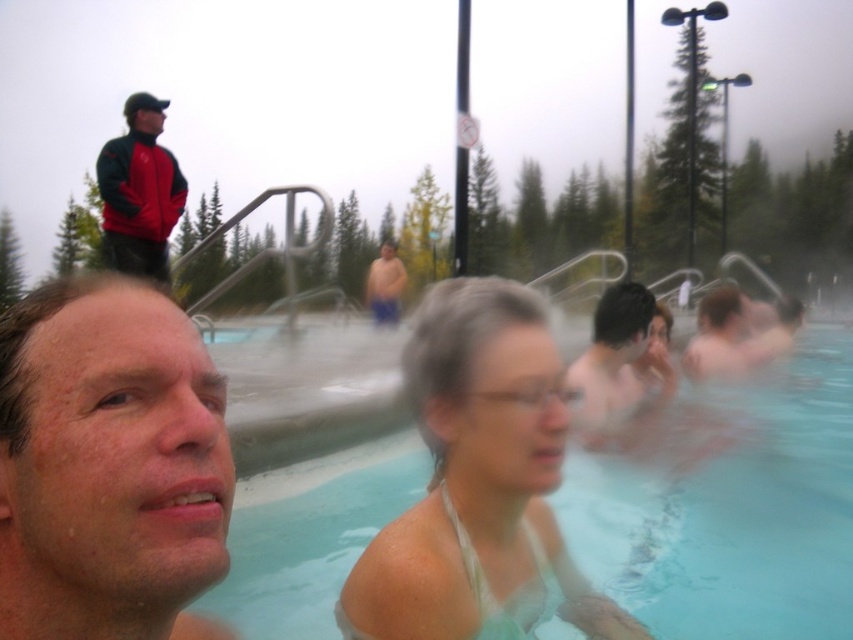
You are a photographer trying to capture the reflection of the dry skin face at center in the clear plastic water at center. Based on their positions, can you confirm if the reflection will be visible?

The clear plastic water at center is not as tall as dry skin face at center, so the reflection of the dry skin face at center should be visible in the water.

You are a swimmer who wants to choose between the white fabric at center and the blue fabric shorts at center for a hot spring visit. Which fabric would be more comfortable based on their thickness?

The white fabric at center is thinner than the blue fabric shorts at center, so the white fabric at center would be more comfortable in the hot spring as thinner fabrics allow better airflow and cooling.

You are a photographer trying to capture a closeup shot of the dry skin face at center and the white fabric at center. Can you fit both subjects into a single frame if your camera has a minimum focus distance of 18 inches?

The distance between the dry skin face at center and the white fabric at center is 18.41 inches. Since the camera requires at least 18 inches between subjects for a single frame, both can be captured together.